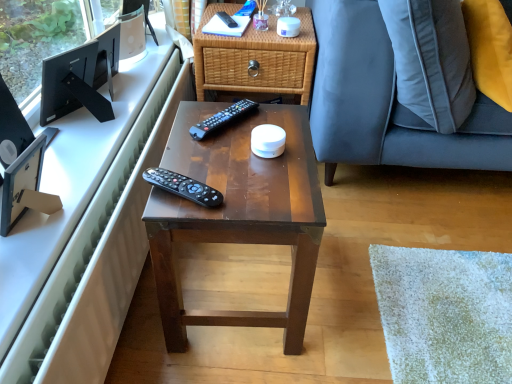
Question: Is woven wood nightstand at upper center positioned in front of brown polished wood desk at center?

Choices:
 (A) yes
 (B) no

Answer: (B)

Question: Considering the relative sizes of woven wood nightstand at upper center and brown polished wood desk at center in the image provided, is woven wood nightstand at upper center wider than brown polished wood desk at center?

Choices:
 (A) yes
 (B) no

Answer: (A)

Question: Is brown polished wood desk at center inside woven wood nightstand at upper center?

Choices:
 (A) no
 (B) yes

Answer: (A)

Question: Considering the relative sizes of woven wood nightstand at upper center and brown polished wood desk at center in the image provided, is woven wood nightstand at upper center taller than brown polished wood desk at center?

Choices:
 (A) yes
 (B) no

Answer: (B)

Question: Is woven wood nightstand at upper center facing away from brown polished wood desk at center?

Choices:
 (A) no
 (B) yes

Answer: (A)

Question: From a real-world perspective, is woven wood nightstand at upper center physically below brown polished wood desk at center?

Choices:
 (A) yes
 (B) no

Answer: (B)

Question: Is woven wood nightstand at upper center in front of black plastic remote control at center, marked as the third remote control in a top-to-bottom arrangement?

Choices:
 (A) no
 (B) yes

Answer: (A)

Question: From the image's perspective, is woven wood nightstand at upper center below black plastic remote control at center, marked as the third remote control in a top-to-bottom arrangement?

Choices:
 (A) no
 (B) yes

Answer: (A)

Question: Is woven wood nightstand at upper center to the right of black plastic remote control at center, which is the first remote control in front-to-back order, from the viewer's perspective?

Choices:
 (A) yes
 (B) no

Answer: (A)

Question: Is woven wood nightstand at upper center aimed at black plastic remote control at center, the 3th remote control from the back?

Choices:
 (A) no
 (B) yes

Answer: (B)

Question: Is woven wood nightstand at upper center oriented away from black plastic remote control at center, the 3th remote control from the back?

Choices:
 (A) no
 (B) yes

Answer: (A)

Question: Are woven wood nightstand at upper center and black plastic remote control at center, the 3th remote control from the back, making contact?

Choices:
 (A) yes
 (B) no

Answer: (B)

Question: Is white glossy computer desk at upper left further to the viewer compared to black plastic remote control at upper center, which is counted as the 1th remote control, starting from the top?

Choices:
 (A) no
 (B) yes

Answer: (A)